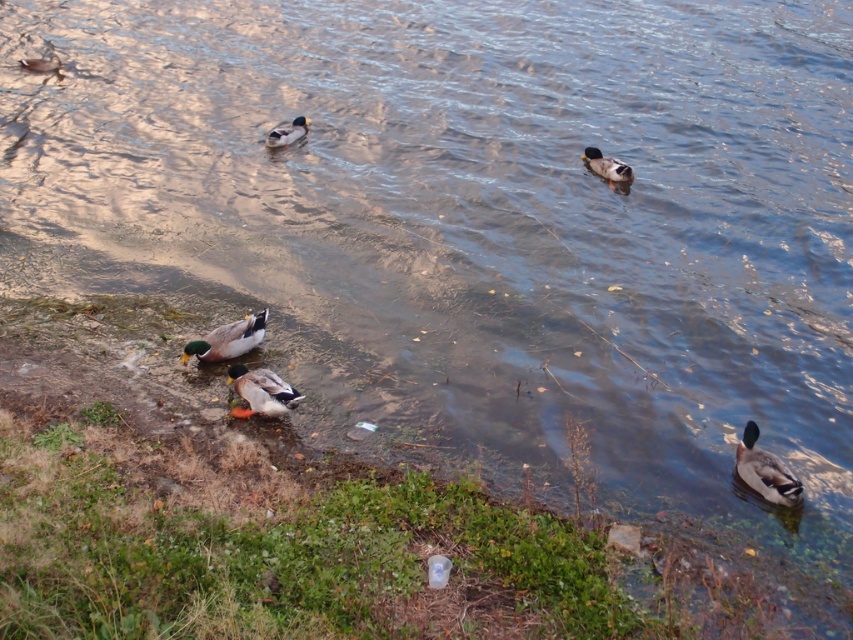
Is matte gray duck at center smaller than matte gray duck at upper left?

No, matte gray duck at center is not smaller than matte gray duck at upper left.

Between matte gray duck at center and matte gray duck at upper left, which one has less height?

matte gray duck at upper left is shorter.

Image resolution: width=853 pixels, height=640 pixels. Describe the element at coordinates (260, 392) in the screenshot. I see `matte gray duck at center` at that location.

Identify the location of matte gray duck at center. The image size is (853, 640). (260, 392).

Between point (229, 355) and point (294, 116), which one is positioned behind?

Positioned behind is point (294, 116).

Which is in front, point (238, 337) or point (288, 131)?

Point (238, 337) is more forward.

Describe the element at coordinates (228, 339) in the screenshot. The width and height of the screenshot is (853, 640). I see `green glossy duck at lower left` at that location.

This screenshot has height=640, width=853. I want to click on green glossy duck at lower left, so click(x=228, y=339).

Which is more to the right, green matte duck at upper center or matte gray duck at upper left?

green matte duck at upper center

Can you confirm if green matte duck at upper center is shorter than matte gray duck at upper left?

In fact, green matte duck at upper center may be taller than matte gray duck at upper left.

Who is more distant from viewer, (270, 145) or (35, 61)?

Point (35, 61)

Where is `green matte duck at upper center`? This screenshot has width=853, height=640. green matte duck at upper center is located at coordinates (287, 132).